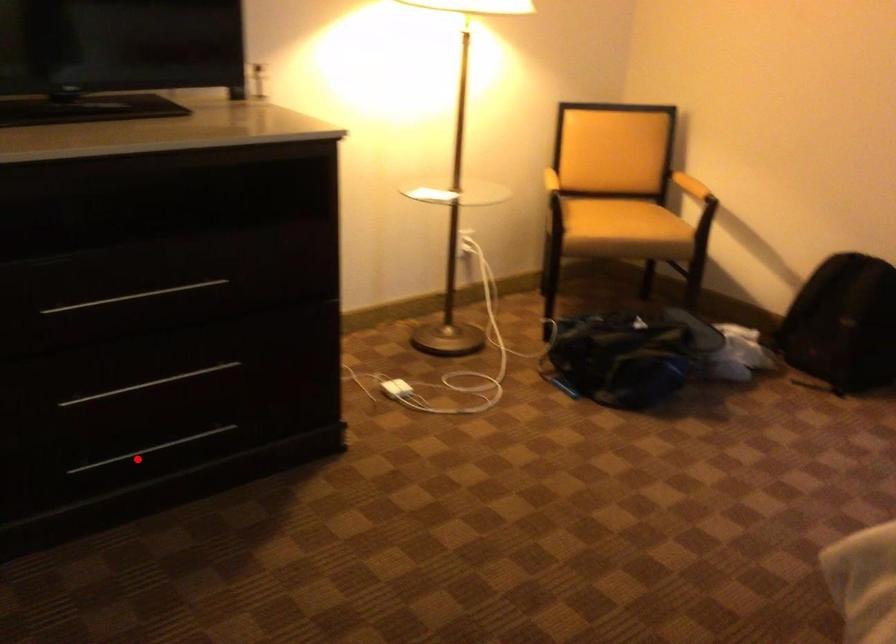
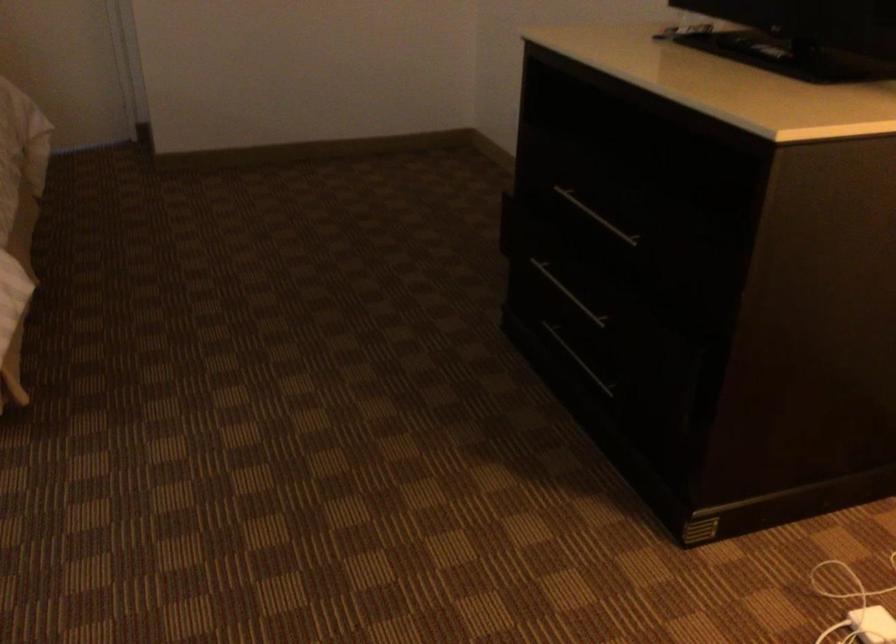
Find the pixel in the second image that matches the highlighted location in the first image.

(579, 360)